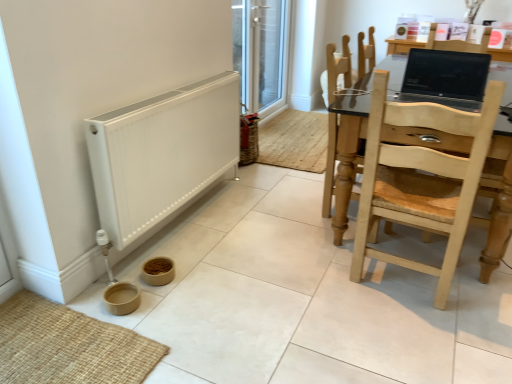
The image size is (512, 384). Find the location of `vacant area that is in front of light wood chair at right, the first chair in the front-to-back sequence`. vacant area that is in front of light wood chair at right, the first chair in the front-to-back sequence is located at coordinates (423, 337).